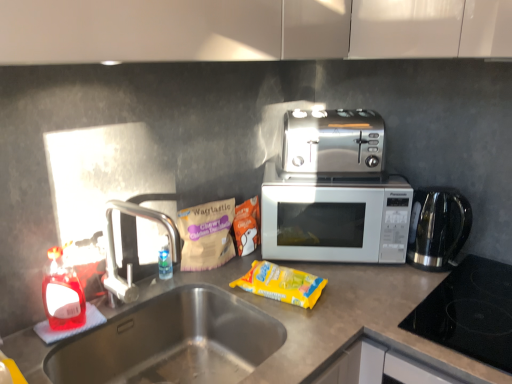
Question: Considering the relative sizes of satin silver toaster at center and silver metallic faucet at left in the image provided, is satin silver toaster at center wider than silver metallic faucet at left?

Choices:
 (A) no
 (B) yes

Answer: (B)

Question: Is satin silver toaster at center behind silver metallic faucet at left?

Choices:
 (A) no
 (B) yes

Answer: (B)

Question: Is the position of satin silver toaster at center less distant than that of silver metallic faucet at left?

Choices:
 (A) yes
 (B) no

Answer: (B)

Question: From a real-world perspective, does satin silver toaster at center sit lower than silver metallic faucet at left?

Choices:
 (A) no
 (B) yes

Answer: (A)

Question: Would you say satin silver toaster at center is outside silver metallic faucet at left?

Choices:
 (A) no
 (B) yes

Answer: (B)

Question: Does point (424, 314) appear closer or farther from the camera than point (279, 284)?

Choices:
 (A) farther
 (B) closer

Answer: (B)

Question: In terms of size, does black glass cooktop at lower right appear bigger or smaller than yellow plastic packet at center, the first snack in the right-to-left sequence?

Choices:
 (A) small
 (B) big

Answer: (B)

Question: From a real-world perspective, is black glass cooktop at lower right physically located above or below yellow plastic packet at center, the first snack in the right-to-left sequence?

Choices:
 (A) below
 (B) above

Answer: (A)

Question: Is black glass cooktop at lower right taller or shorter than yellow plastic packet at center, arranged as the 3th snack when viewed from the left?

Choices:
 (A) tall
 (B) short

Answer: (A)

Question: Is silver metallic faucet at left wider or thinner than translucent plastic bottle at sink left?

Choices:
 (A) wide
 (B) thin

Answer: (A)

Question: Does point (135, 299) appear closer or farther from the camera than point (69, 322)?

Choices:
 (A) closer
 (B) farther

Answer: (B)

Question: Considering the relative positions of silver metallic faucet at left and translucent plastic bottle at sink left in the image provided, is silver metallic faucet at left to the left or to the right of translucent plastic bottle at sink left?

Choices:
 (A) left
 (B) right

Answer: (B)

Question: Is silver metallic faucet at left situated inside translucent plastic bottle at sink left or outside?

Choices:
 (A) inside
 (B) outside

Answer: (B)

Question: Choose the correct answer: Is yellow plastic packet at center, the first snack in the right-to-left sequence, inside silver metallic microwave at center or outside it?

Choices:
 (A) outside
 (B) inside

Answer: (A)

Question: In terms of width, does yellow plastic packet at center, arranged as the 3th snack when viewed from the left, look wider or thinner when compared to silver metallic microwave at center?

Choices:
 (A) wide
 (B) thin

Answer: (B)